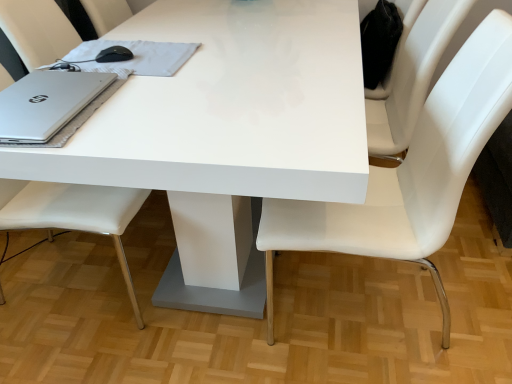
Where is `vacant area that lies between silver metallic laptop at left and satin silver notebook at upper left`? vacant area that lies between silver metallic laptop at left and satin silver notebook at upper left is located at coordinates (124, 96).